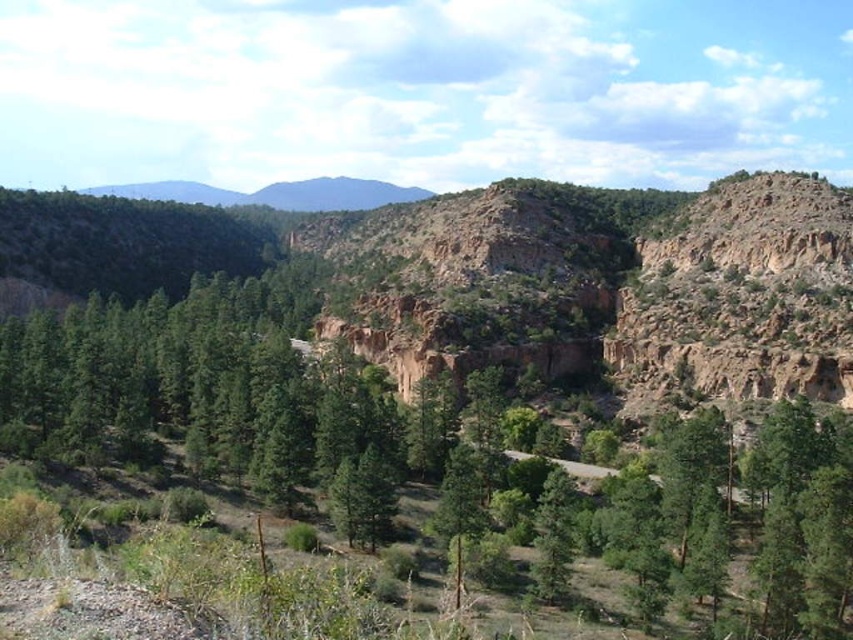
Between green matte tree at center and green rough bark tree at center, which one appears on the right side from the viewer's perspective?

Positioned to the right is green rough bark tree at center.

Is point (492, 416) closer to viewer compared to point (456, 448)?

No, (492, 416) is behind (456, 448).

Is point (274, 401) positioned behind point (465, 506)?

Yes, point (274, 401) is farther from viewer.

You are a GUI agent. You are given a task and a screenshot of the screen. Output one action in this format:
    pyautogui.click(x=<x>, y=<y>)
    Task: Click on the green matte tree at center
    
    Given the screenshot: What is the action you would take?
    pyautogui.click(x=421, y=445)